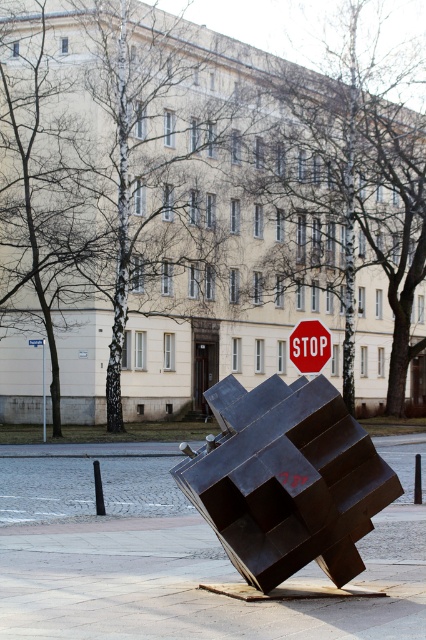
Question: Considering the relative positions of metallic pavement at center and red plastic stop sign at upper center in the image provided, where is metallic pavement at center located with respect to red plastic stop sign at upper center?

Choices:
 (A) above
 (B) below

Answer: (B)

Question: Is red plastic stop sign at upper center smaller than red stop sign at center?

Choices:
 (A) no
 (B) yes

Answer: (B)

Question: Which of the following is the farthest from the observer?

Choices:
 (A) metallic pavement at center
 (B) red stop sign at center
 (C) red plastic stop sign at upper center
 (D) metallic street sign at upper left

Answer: (B)

Question: From the image, what is the correct spatial relationship of metallic pavement at center in relation to red plastic stop sign at upper center?

Choices:
 (A) above
 (B) below

Answer: (B)

Question: Which object is closer to the camera taking this photo?

Choices:
 (A) metallic street sign at upper left
 (B) metallic pavement at center
 (C) red plastic stop sign at upper center

Answer: (B)

Question: Which point is farther to the camera?

Choices:
 (A) (45, 417)
 (B) (250, 618)
 (C) (322, 339)
 (D) (37, 340)

Answer: (A)